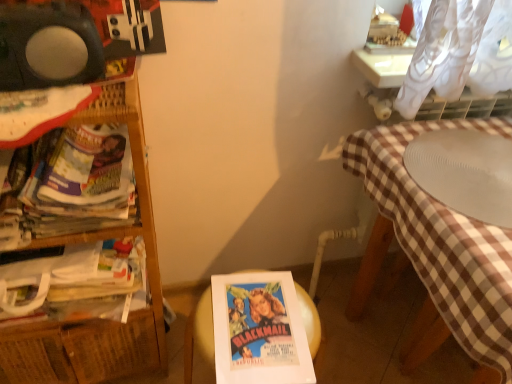
Question: From the image's perspective, is woven wood shelf at left below white ribbed plate at right?

Choices:
 (A) yes
 (B) no

Answer: (A)

Question: Is the position of woven wood shelf at left more distant than that of white ribbed plate at right?

Choices:
 (A) yes
 (B) no

Answer: (B)

Question: From the image's perspective, is woven wood shelf at left on top of white ribbed plate at right?

Choices:
 (A) no
 (B) yes

Answer: (A)

Question: Considering the relative sizes of woven wood shelf at left and white ribbed plate at right in the image provided, is woven wood shelf at left thinner than white ribbed plate at right?

Choices:
 (A) no
 (B) yes

Answer: (B)

Question: Is white ribbed plate at right surrounded by woven wood shelf at left?

Choices:
 (A) no
 (B) yes

Answer: (A)

Question: Is the depth of woven wood shelf at left less than that of white ribbed plate at right?

Choices:
 (A) no
 (B) yes

Answer: (B)

Question: Is white paper at center outside of white ribbed plate at right?

Choices:
 (A) yes
 (B) no

Answer: (A)

Question: Considering the relative positions of white paper at center and white ribbed plate at right in the image provided, is white paper at center to the right of white ribbed plate at right from the viewer's perspective?

Choices:
 (A) yes
 (B) no

Answer: (B)

Question: Could you tell me if white paper at center is turned towards white ribbed plate at right?

Choices:
 (A) no
 (B) yes

Answer: (A)

Question: From a real-world perspective, is white paper at center beneath white ribbed plate at right?

Choices:
 (A) yes
 (B) no

Answer: (A)

Question: Does white paper at center have a greater width compared to white ribbed plate at right?

Choices:
 (A) no
 (B) yes

Answer: (A)

Question: Considering the relative sizes of white paper at center and white ribbed plate at right in the image provided, is white paper at center bigger than white ribbed plate at right?

Choices:
 (A) no
 (B) yes

Answer: (A)

Question: Considering the relative positions of woven wood shelf at left and white paper at center in the image provided, is woven wood shelf at left to the left of white paper at center from the viewer's perspective?

Choices:
 (A) yes
 (B) no

Answer: (A)